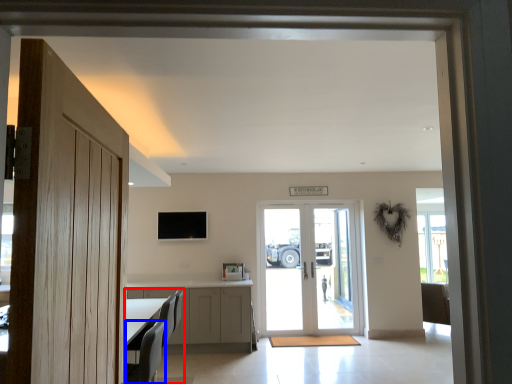
Question: Among these objects, which one is farthest to the camera, furniture (highlighted by a red box) or armchair (highlighted by a blue box)?

Choices:
 (A) furniture
 (B) armchair

Answer: (A)